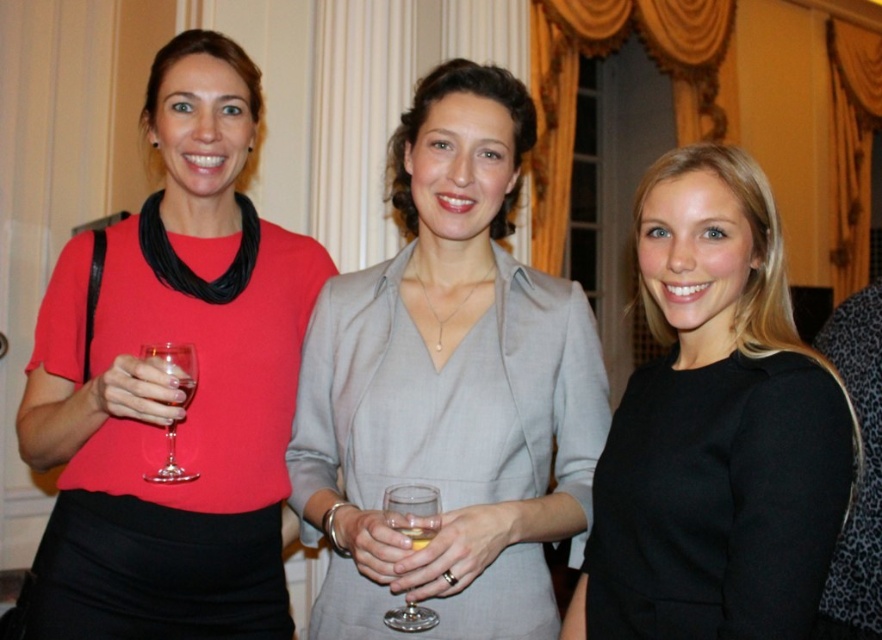
Is matte gray dress at center below translucent glass at center?

No.

Does matte gray dress at center have a greater width compared to translucent glass at center?

Correct, the width of matte gray dress at center exceeds that of translucent glass at center.

Image resolution: width=882 pixels, height=640 pixels. What are the coordinates of `matte gray dress at center` in the screenshot? It's located at (447, 387).

Find the location of a particular element. The width and height of the screenshot is (882, 640). matte gray dress at center is located at coordinates (447, 387).

Based on the photo, does matte gray dress at center have a lesser height compared to black matte dress at center?

Incorrect, matte gray dress at center's height does not fall short of black matte dress at center's.

Which is in front, point (488, 576) or point (669, 273)?

Positioned in front is point (669, 273).

Is point (454, 422) more distant than point (828, 397)?

Yes, point (454, 422) is farther from viewer.

Image resolution: width=882 pixels, height=640 pixels. In order to click on matte gray dress at center in this screenshot , I will do `click(447, 387)`.

Locate an element on the screen. This screenshot has height=640, width=882. transparent glass at left is located at coordinates (176, 364).

Describe the element at coordinates (176, 364) in the screenshot. I see `transparent glass at left` at that location.

Where is `transparent glass at left`? This screenshot has width=882, height=640. transparent glass at left is located at coordinates (176, 364).